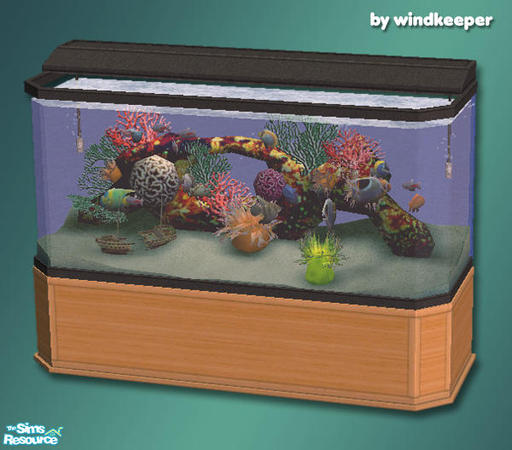
I want to click on plant, so click(323, 264).